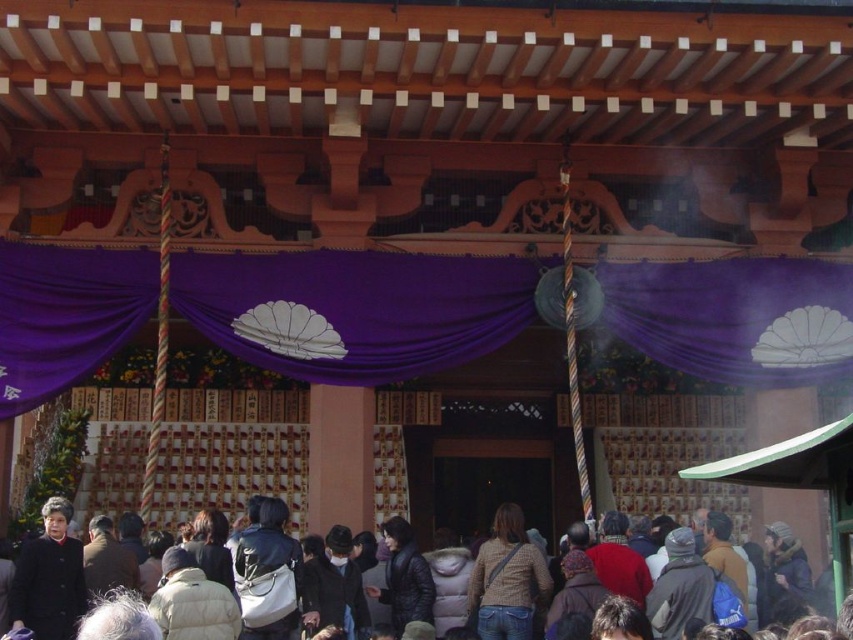
Can you confirm if dark brown leather jacket at lower center is thinner than dark brown leather coat at lower left?

No.

Who is positioned more to the left, dark brown leather jacket at lower center or dark brown leather coat at lower left?

dark brown leather coat at lower left is more to the left.

Does point (109, 609) come farther from viewer compared to point (19, 560)?

No, it is not.

I want to click on dark brown leather jacket at lower center, so click(x=120, y=620).

Is point (753, 360) in front of point (500, 621)?

No.

Between purple fabric curtain at center and dark brown leather jacket at lower center, which one appears on the right side from the viewer's perspective?

Positioned to the right is purple fabric curtain at center.

Which is behind, point (705, 333) or point (109, 621)?

The point (705, 333) is more distant.

Identify the location of purple fabric curtain at center. The height and width of the screenshot is (640, 853). (354, 308).

Locate an element on the screen. The image size is (853, 640). purple fabric curtain at center is located at coordinates (354, 308).

Is purple fabric curtain at center taller than dark brown leather coat at lower left?

Indeed, purple fabric curtain at center has a greater height compared to dark brown leather coat at lower left.

Who is more forward, (231, 253) or (53, 536)?

Positioned in front is point (53, 536).

Where is `purple fabric curtain at center`? The width and height of the screenshot is (853, 640). purple fabric curtain at center is located at coordinates (354, 308).